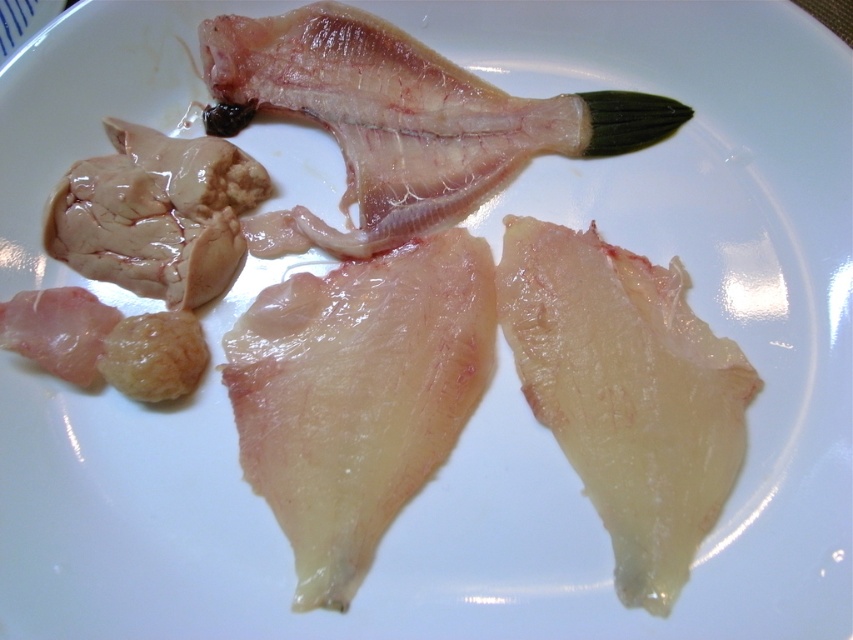
Question: Which point is farther from the camera taking this photo?

Choices:
 (A) (329, 365)
 (B) (334, 42)

Answer: (B)

Question: Which of the following is the farthest from the observer?

Choices:
 (A) translucent flesh at center
 (B) translucent flesh fish at upper center

Answer: (B)

Question: Does translucent flesh at center appear on the left side of translucent flesh fish at upper center?

Choices:
 (A) yes
 (B) no

Answer: (A)

Question: Is translucent flesh at center below translucent flesh fish at upper center?

Choices:
 (A) no
 (B) yes

Answer: (B)

Question: Does translucent flesh at center appear under translucent flesh fish at upper center?

Choices:
 (A) yes
 (B) no

Answer: (A)